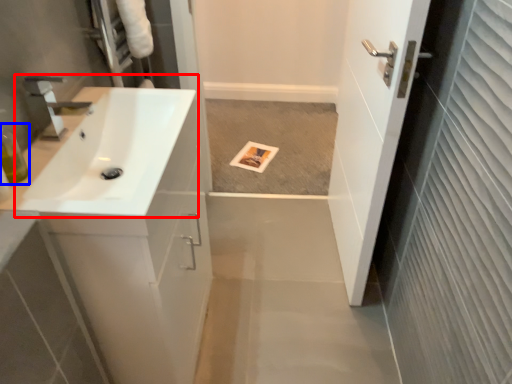
Question: Which of the following is the farthest to the observer, sink (highlighted by a red box) or toiletry (highlighted by a blue box)?

Choices:
 (A) sink
 (B) toiletry

Answer: (B)